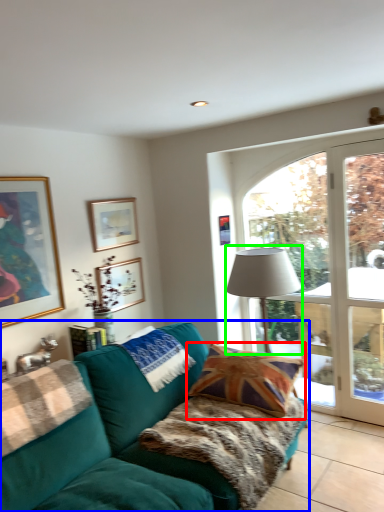
Question: Based on their relative distances, which object is nearer to pillow (highlighted by a red box)? Choose from studio couch (highlighted by a blue box) and table lamp (highlighted by a green box).

Choices:
 (A) studio couch
 (B) table lamp

Answer: (A)